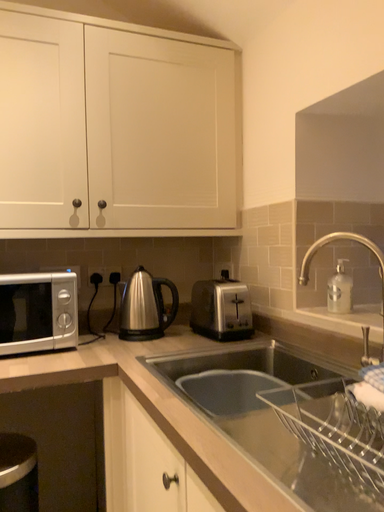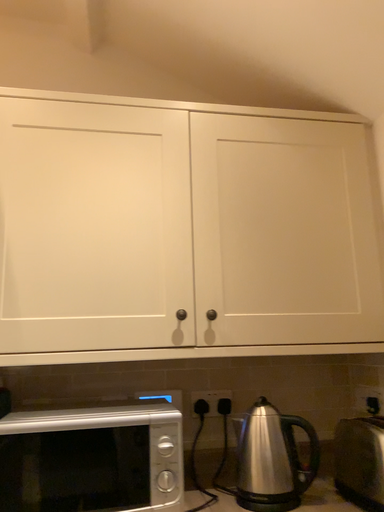
Question: Which way did the camera rotate in the video?

Choices:
 (A) rotated upward
 (B) rotated downward

Answer: (A)